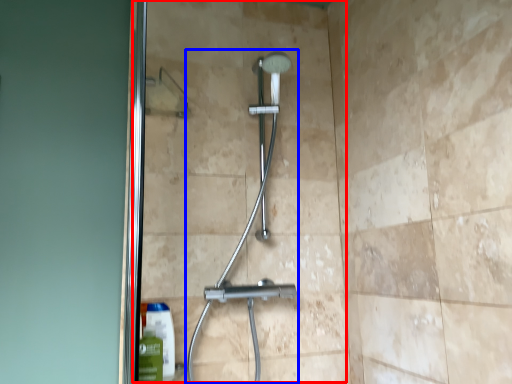
Question: Which object appears farthest to the camera in this image, glass door (highlighted by a red box) or shower (highlighted by a blue box)?

Choices:
 (A) glass door
 (B) shower

Answer: (A)